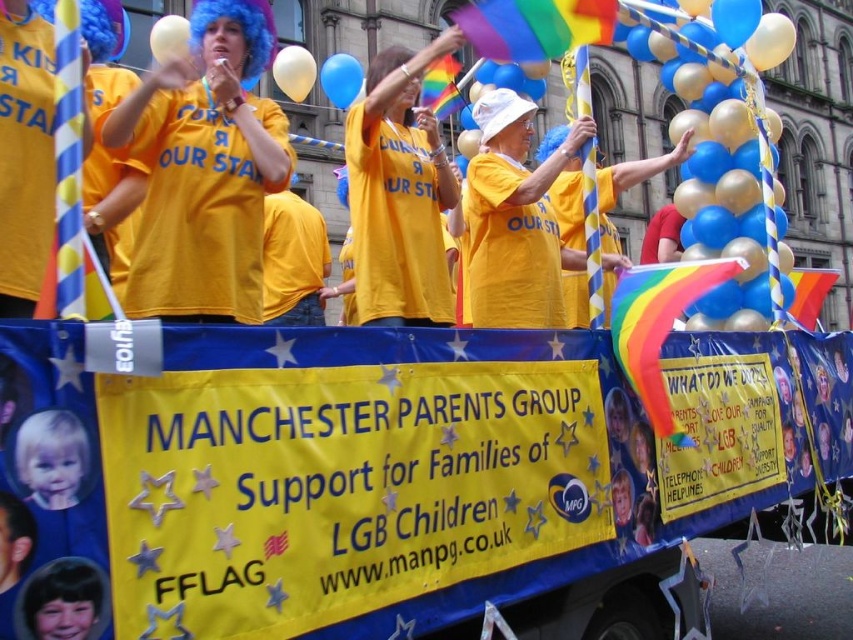
You are a photographer taking a picture of the Manchester Parents Group float. You notice the blue metallic balloons at upper right and the smooth black hair at lower left in your frame. Which object should you focus on first if you want to capture the one that is higher up in the image?

The blue metallic balloons at upper right is much taller as smooth black hair at lower left, so you should focus on the blue metallic balloons at upper right first since it is higher up in the image.

You are a photographer taking pictures of the Manchester Parents Group float. You notice two white balloons in the frame. The white glossy balloon at upper center and the white matte balloon at upper left. Which balloon is closer to the camera?

The white glossy balloon at upper center is closer to the camera because the white matte balloon at upper left is behind it.

You are a photographer at the Manchester Parents Group parade float. You want to take a photo that includes both the blue metallic balloons at upper right and the smooth black hair at lower left. Which object should you position to the right side of your frame to ensure both are captured?

The blue metallic balloons at upper right are to the right of the smooth black hair at lower left, so position the blue metallic balloons at upper right on the right side of the frame to include both.